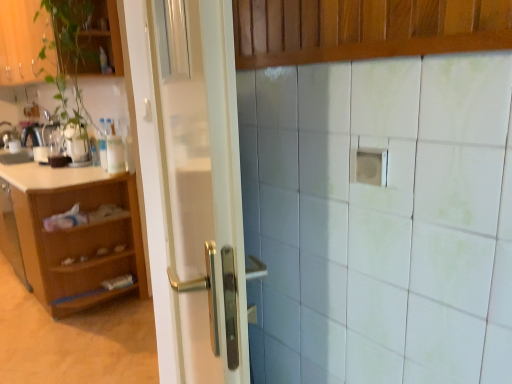
Question: Based on their positions, is light brown wood cabinet at left, the 3th cabinetry in the top-to-bottom sequence, located to the left or right of green matte plant at upper left, acting as the 1th cabinetry starting from the top?

Choices:
 (A) left
 (B) right

Answer: (A)

Question: Considering the positions of light brown wood cabinet at left, the 3th cabinetry in the front-to-back sequence, and green matte plant at upper left, acting as the 1th cabinetry starting from the top, in the image, is light brown wood cabinet at left, the 3th cabinetry in the front-to-back sequence, wider or thinner than green matte plant at upper left, acting as the 1th cabinetry starting from the top,?

Choices:
 (A) thin
 (B) wide

Answer: (B)

Question: Which object is positioned farthest from the green matte plant at upper left, which is the third cabinetry in bottom-to-top order?

Choices:
 (A) white glossy sink at left
 (B) wooden paneling at upper center, which is counted as the 2th cabinetry, starting from the top
 (C) green glossy plant at upper left
 (D) light brown wood cabinet at left, the 3th cabinetry in the top-to-bottom sequence
 (E) white glossy door at center

Answer: (B)

Question: Which object is the closest to the green matte plant at upper left, the second cabinetry in the back-to-front sequence?

Choices:
 (A) white glossy door at center
 (B) wooden paneling at upper center, the 3th cabinetry when ordered from back to front
 (C) white glossy pot at left
 (D) white glossy sink at left
 (E) light brown wood cabinet at left, the first cabinetry when ordered from bottom to top

Answer: (C)